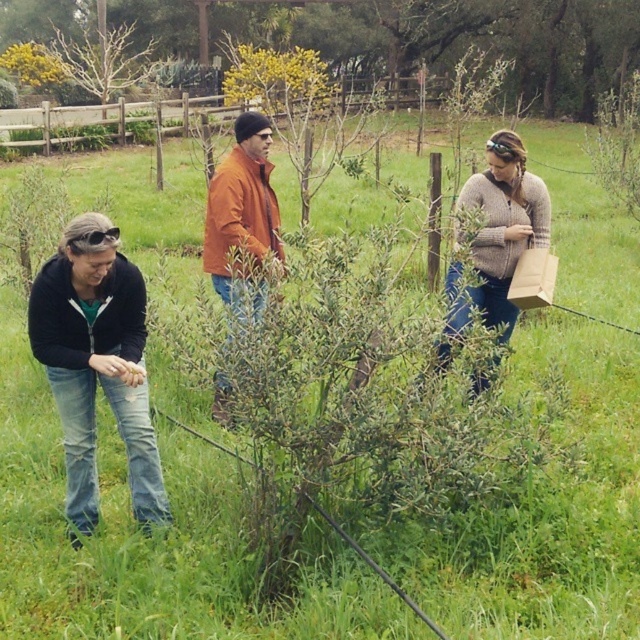
You are a photographer trying to capture a group photo of the knitted sweater at center and the orange leather jacket at center. The camera you are using has a maximum focus range of 4 feet. Can you take a photo of both subjects without moving them?

The distance between the knitted sweater at center and orange leather jacket at center is 4.38 feet, which exceeds the camera maximum focus range of 4 feet. Therefore, you cannot take a photo of both subjects without moving them.

Where is the knitted sweater at center located in the image?

The knitted sweater at center is located at point (502, 225) in the image.